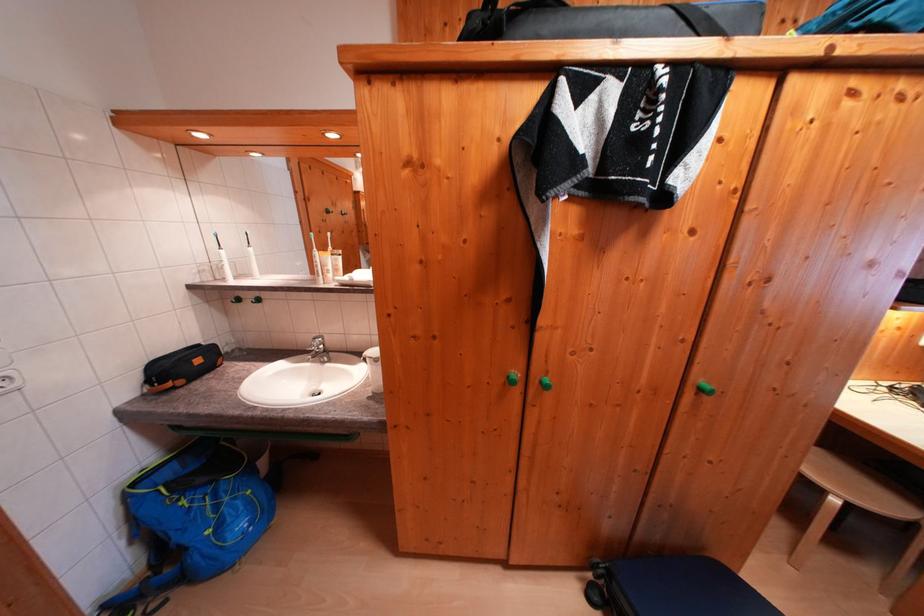
Locate an element on the screen. blue backpack is located at coordinates (192, 517).